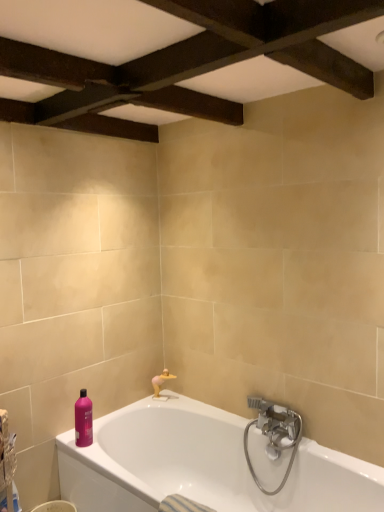
The image size is (384, 512). Find the location of `vacant area on top of satin nickel faucet at lower right (from a real-world perspective)`. vacant area on top of satin nickel faucet at lower right (from a real-world perspective) is located at coordinates (280, 402).